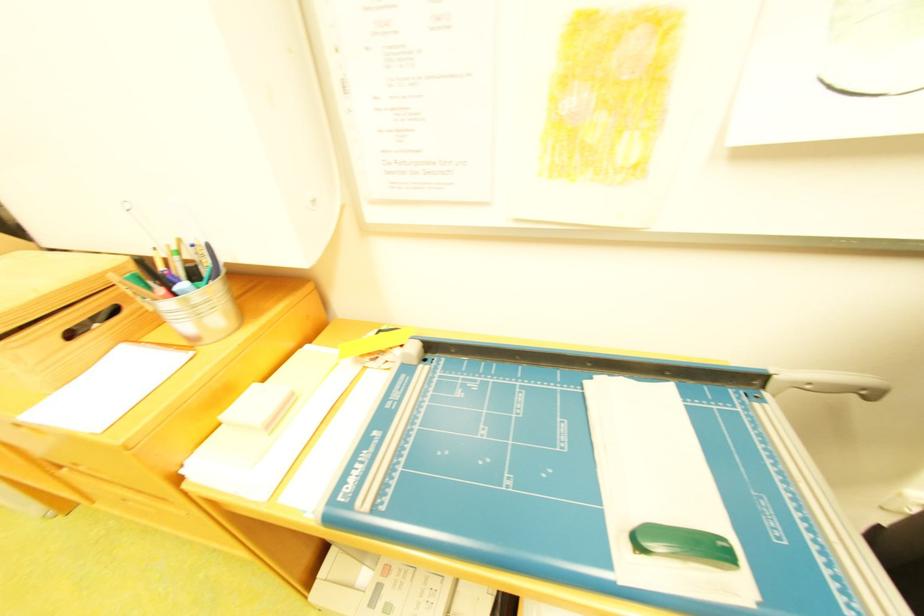
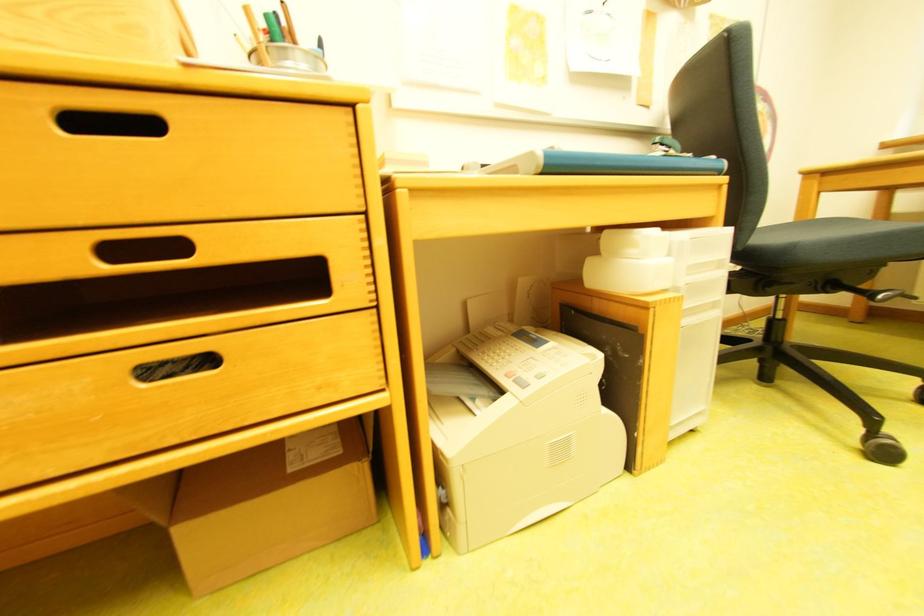
Where in the second image is the point corresponding to (395,588) from the first image?

(531, 378)